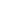
This screenshot has width=1, height=1. In order to click on right sided corner in this screenshot , I will do pos(0,0).